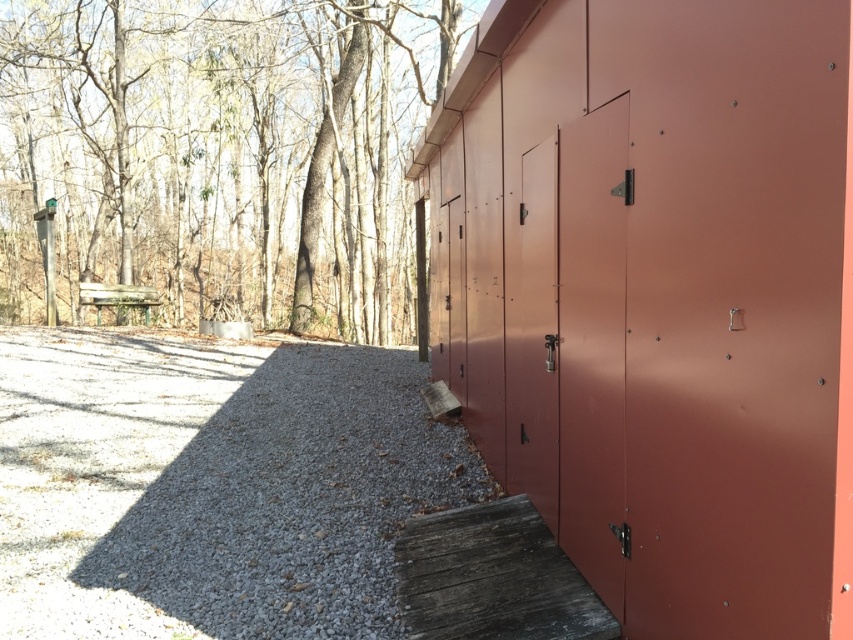
Question: Is bare wood tree at upper left positioned before matte red door at center?

Choices:
 (A) yes
 (B) no

Answer: (B)

Question: Can you confirm if matte red door at center is wider than weathered wood ramp at lower center?

Choices:
 (A) yes
 (B) no

Answer: (B)

Question: Can you confirm if metallic red cabinet at right is positioned below weathered wood ramp at lower center?

Choices:
 (A) yes
 (B) no

Answer: (B)

Question: Estimate the real-world distances between objects in this image. Which object is farther from the gray gravel at lower left?

Choices:
 (A) matte metal door at center
 (B) matte red door at center

Answer: (B)

Question: Which of these objects is positioned closest to the matte metal door at center?

Choices:
 (A) weathered wood ramp at lower center
 (B) bare wood tree at upper left

Answer: (A)

Question: Which point is closer to the camera?

Choices:
 (A) (561, 586)
 (B) (573, 467)
 (C) (718, 561)

Answer: (C)